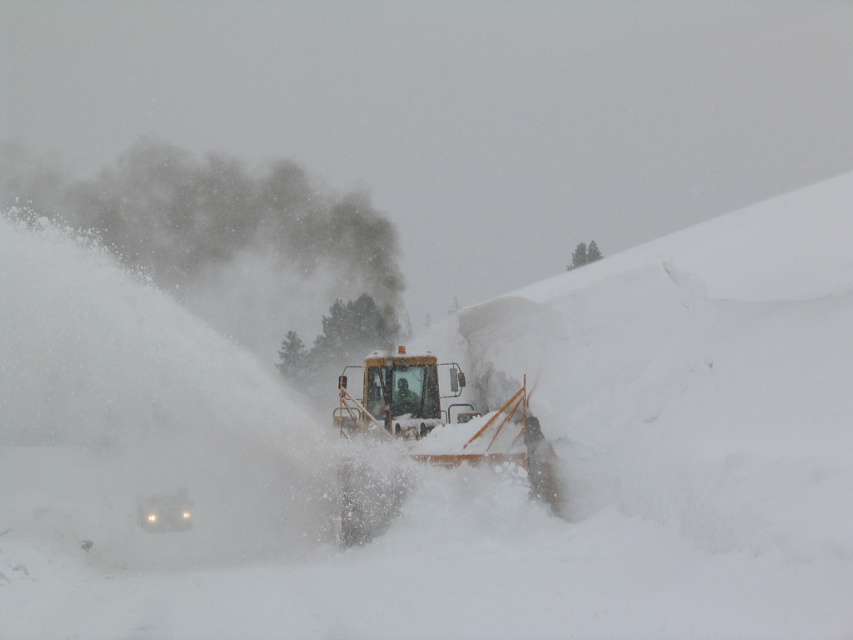
Question: Does white powdery snow at center appear over yellow metallic snowplow at center?

Choices:
 (A) yes
 (B) no

Answer: (A)

Question: Is white powdery snow at center closer to camera compared to yellow metallic snowplow at center?

Choices:
 (A) no
 (B) yes

Answer: (B)

Question: Which point is closer to the camera taking this photo?

Choices:
 (A) (137, 419)
 (B) (399, 394)

Answer: (A)

Question: Which point is farther to the camera?

Choices:
 (A) (345, 502)
 (B) (548, 566)

Answer: (A)

Question: Considering the relative positions of white powdery snow at center and yellow metallic snowplow at center in the image provided, where is white powdery snow at center located with respect to yellow metallic snowplow at center?

Choices:
 (A) below
 (B) above

Answer: (B)

Question: Which of the following is the farthest from the observer?

Choices:
 (A) (357, 400)
 (B) (125, 544)

Answer: (A)